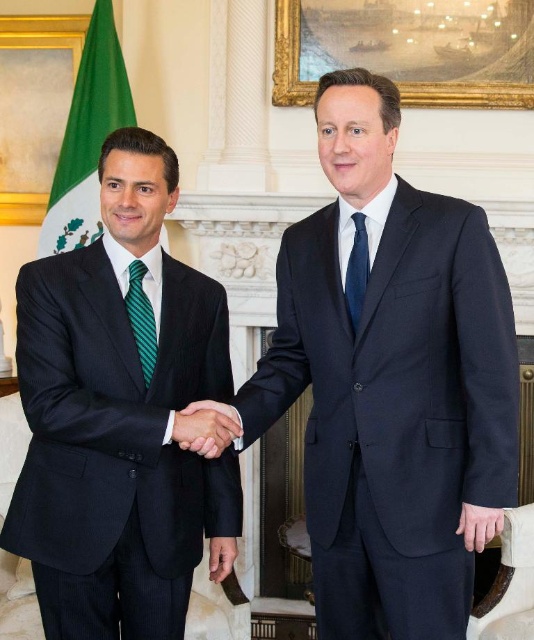
You are an event photographer at a diplomatic meeting. You need to capture a photo of the two men shaking hands while ensuring the green striped tie at left and the matte black hands at center are both visible in the frame. Based on their positions, which object is closer to the left edge of the image?

The green striped tie at left is closer to the left edge of the image because the matte black hands at center are positioned to the right of it.

You are a photographer taking a picture of the two men shaking hands in the formal meeting. You need to ensure that the matte black hands at center are clearly visible in the photo. Where exactly should you focus your camera? Please provide the coordinates in the format of a point like point (x=206, y=428).

You should focus your camera at point (x=206, y=428) where the matte black hands at center are located.